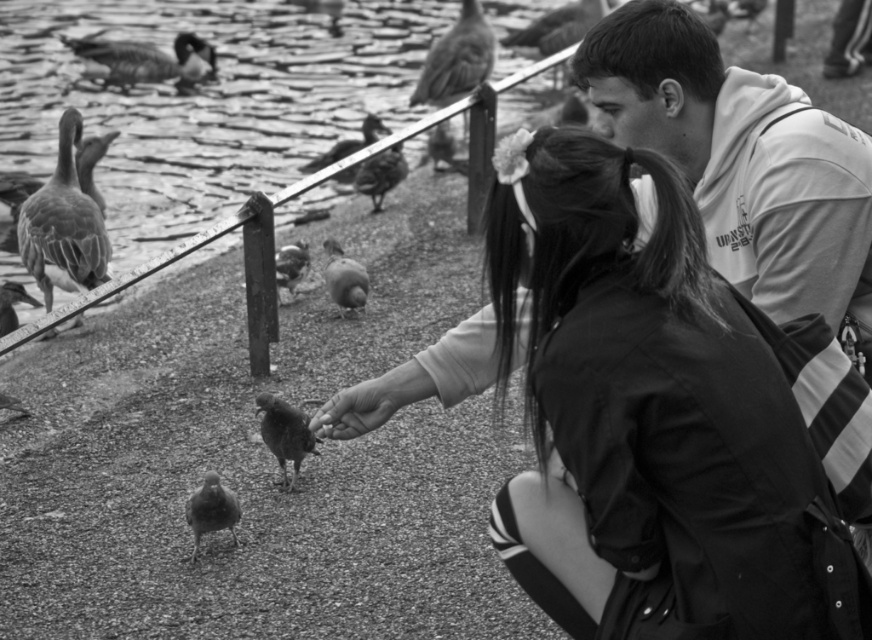
Between smooth gray duck at left and smooth gray duck at center, which one is positioned lower?

Positioned lower is smooth gray duck at left.

Which of these two, smooth gray duck at left or smooth gray duck at center, stands taller?

Standing taller between the two is smooth gray duck at left.

Is point (106, 234) closer to viewer compared to point (351, 138)?

Yes, point (106, 234) is in front of point (351, 138).

You are a GUI agent. You are given a task and a screenshot of the screen. Output one action in this format:
    pyautogui.click(x=<x>, y=<y>)
    Task: Click on the smooth gray duck at left
    This screenshot has height=640, width=872.
    Given the screenshot: What is the action you would take?
    pyautogui.click(x=63, y=225)

From the picture: Is white fleece hoodie at upper right taller than smooth feathered pigeon at lower left?

Indeed, white fleece hoodie at upper right has a greater height compared to smooth feathered pigeon at lower left.

Who is positioned more to the left, white fleece hoodie at upper right or smooth feathered pigeon at lower left?

From the viewer's perspective, smooth feathered pigeon at lower left appears more on the left side.

Measure the distance between point (584, 48) and camera.

They are 4.49 meters apart.

The width and height of the screenshot is (872, 640). What are the coordinates of `white fleece hoodie at upper right` in the screenshot? It's located at (741, 161).

Can you confirm if white fleece hoodie at upper right is wider than smooth gray duck at center?

Correct, the width of white fleece hoodie at upper right exceeds that of smooth gray duck at center.

Is white fleece hoodie at upper right further to camera compared to smooth gray duck at center?

No, it is not.

Which is behind, point (802, 97) or point (337, 156)?

Positioned behind is point (337, 156).

This screenshot has width=872, height=640. I want to click on white fleece hoodie at upper right, so click(741, 161).